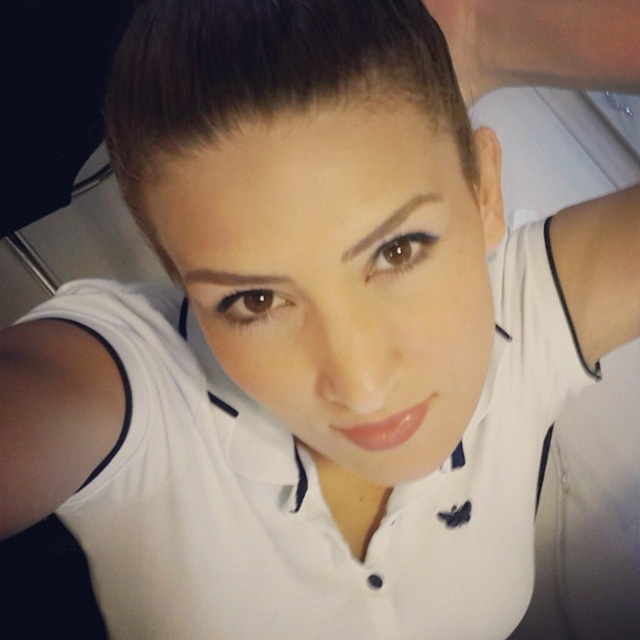
Question: Does white cotton polo shirt at center have a greater width compared to brownhaireyebrow at center?

Choices:
 (A) yes
 (B) no

Answer: (A)

Question: Which of the following is the closest to the observer?

Choices:
 (A) (243, 4)
 (B) (298, 627)
 (C) (390, 220)

Answer: (A)

Question: Is white cotton polo shirt at center bigger than dark brown shiny hair at upper center?

Choices:
 (A) yes
 (B) no

Answer: (A)

Question: Which object is positioned farthest from the white cotton polo shirt at center?

Choices:
 (A) dark brown shiny hair at upper center
 (B) brownhaireyebrow at center

Answer: (B)

Question: Does white cotton polo shirt at center appear on the left side of brownhair-likeeyebrow at upper center?

Choices:
 (A) yes
 (B) no

Answer: (B)

Question: Which of the following is the farthest from the observer?

Choices:
 (A) (371, 241)
 (B) (236, 35)
 (C) (224, 276)

Answer: (C)